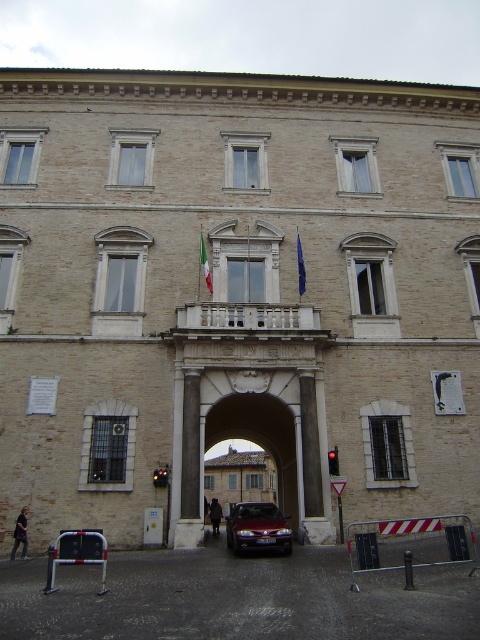
Question: Which of the following is the farthest from the observer?

Choices:
 (A) (220, 512)
 (B) (13, 557)
 (C) (206, 262)

Answer: (A)

Question: In this image, where is denim jacket at lower left located relative to blue fabric flag at center?

Choices:
 (A) left
 (B) right

Answer: (A)

Question: Does blue fabric flag at center appear on the right side of green fabric flag at center?

Choices:
 (A) no
 (B) yes

Answer: (B)

Question: Which of the following is the closest to the observer?

Choices:
 (A) satin silver sedan at center
 (B) denim jacket at lower left

Answer: (A)

Question: Does smooth stone archway at center lie behind dark brown leather coat at center?

Choices:
 (A) yes
 (B) no

Answer: (B)

Question: Among these points, which one is farthest from the camera?

Choices:
 (A) (295, 467)
 (B) (300, 250)
 (C) (248, 515)

Answer: (A)